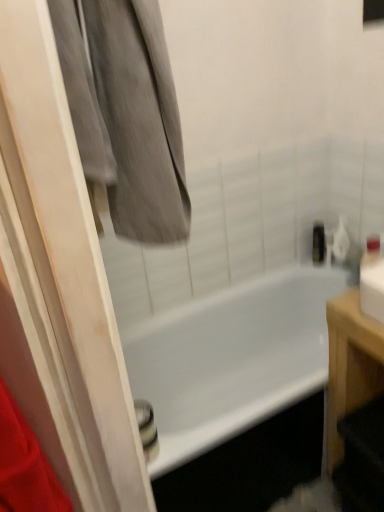
Question: Is metallic silver toiletry at upper right thinner than white glossy bathtub at center?

Choices:
 (A) no
 (B) yes

Answer: (B)

Question: Is metallic silver toiletry at upper right positioned with its back to white glossy bathtub at center?

Choices:
 (A) no
 (B) yes

Answer: (A)

Question: Does metallic silver toiletry at upper right have a greater height compared to white glossy bathtub at center?

Choices:
 (A) yes
 (B) no

Answer: (B)

Question: From a real-world perspective, is metallic silver toiletry at upper right on top of white glossy bathtub at center?

Choices:
 (A) no
 (B) yes

Answer: (B)

Question: Is metallic silver toiletry at upper right positioned far away from white glossy bathtub at center?

Choices:
 (A) no
 (B) yes

Answer: (A)

Question: Does point (321, 240) appear closer or farther from the camera than point (334, 325)?

Choices:
 (A) farther
 (B) closer

Answer: (A)

Question: Looking at the image, does metallic silver toiletry at upper right seem bigger or smaller compared to light brown wooden table at right?

Choices:
 (A) big
 (B) small

Answer: (B)

Question: Do you think metallic silver toiletry at upper right is within light brown wooden table at right, or outside of it?

Choices:
 (A) outside
 (B) inside

Answer: (A)

Question: In terms of height, does metallic silver toiletry at upper right look taller or shorter compared to light brown wooden table at right?

Choices:
 (A) tall
 (B) short

Answer: (B)

Question: Visually, is white glossy bathtub at center positioned to the left or to the right of gray fabric at upper left?

Choices:
 (A) left
 (B) right

Answer: (B)

Question: From a real-world perspective, is white glossy bathtub at center physically located above or below gray fabric at upper left?

Choices:
 (A) below
 (B) above

Answer: (A)

Question: Which is correct: white glossy bathtub at center is inside gray fabric at upper left, or outside of it?

Choices:
 (A) inside
 (B) outside

Answer: (B)

Question: Considering their positions, is white glossy bathtub at center located in front of or behind gray fabric at upper left?

Choices:
 (A) behind
 (B) front

Answer: (A)

Question: In the image, is white glossy bathtub at center on the left side or the right side of metallic silver toiletry at upper right?

Choices:
 (A) left
 (B) right

Answer: (A)

Question: Is white glossy bathtub at center inside or outside of metallic silver toiletry at upper right?

Choices:
 (A) outside
 (B) inside

Answer: (A)